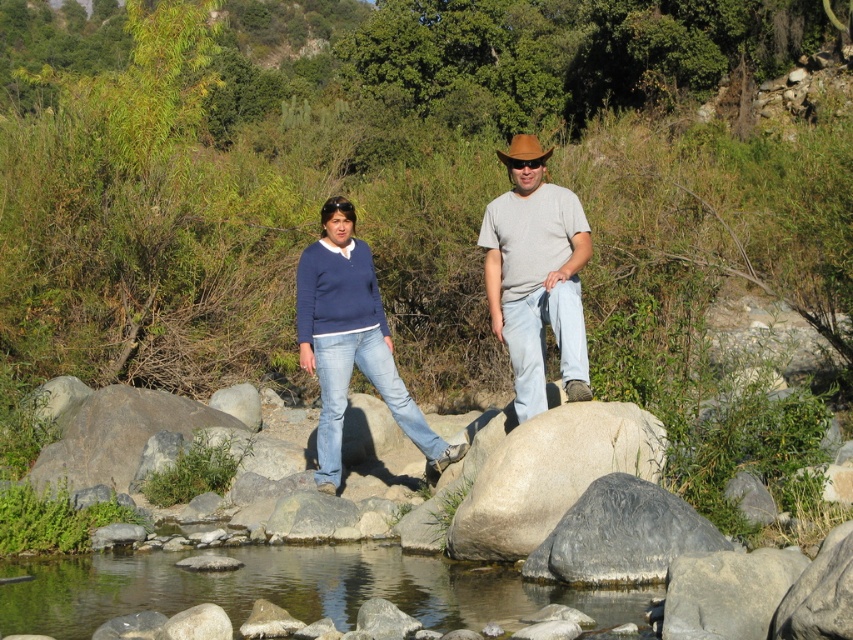
Question: Does blue denim jeans at center come in front of gray rough boulder at lower center?

Choices:
 (A) no
 (B) yes

Answer: (A)

Question: Is denim jeans at center smaller than smooth gray rock at center?

Choices:
 (A) no
 (B) yes

Answer: (B)

Question: Which point is farther from the camera taking this photo?

Choices:
 (A) (515, 141)
 (B) (643, 513)
 (C) (538, 228)

Answer: (A)

Question: Which object appears closest to the camera in this image?

Choices:
 (A) denim jeans at center
 (B) clear water at stream center
 (C) smooth gray rock at center
 (D) blue denim jeans at center

Answer: (B)

Question: Which point is closer to the camera?

Choices:
 (A) pos(633,609)
 (B) pos(552,184)
 (C) pos(556,508)

Answer: (A)

Question: Does clear water at stream center appear over smooth gray rock at center?

Choices:
 (A) no
 (B) yes

Answer: (A)